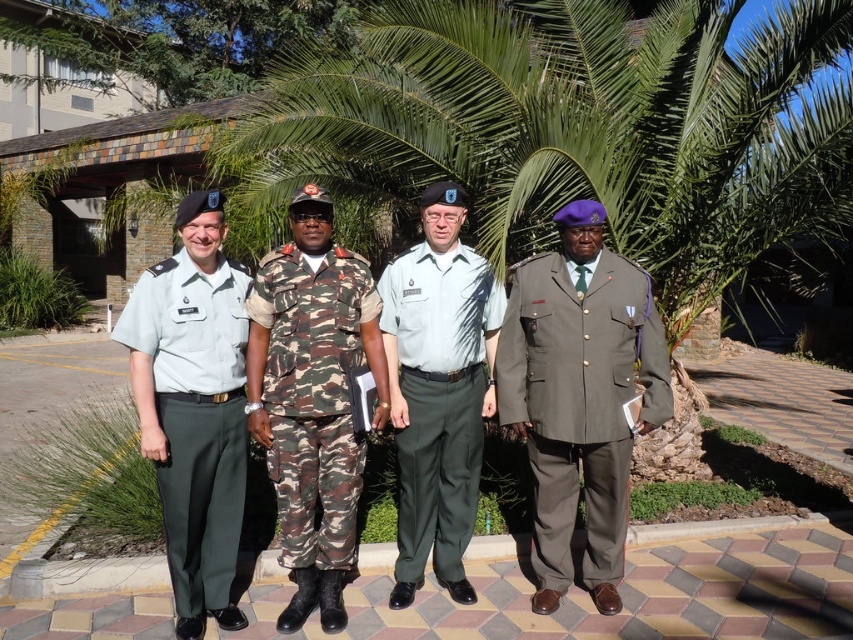
Question: Which object is the farthest from the camo fabric uniform at center?

Choices:
 (A) light gray cotton shirt at center
 (B) camouflage fabric uniform at center
 (C) light green fabric uniform at left

Answer: (A)

Question: Which point is closer to the camera?

Choices:
 (A) camouflage fabric uniform at center
 (B) light green fabric uniform at left
 (C) camo fabric uniform at center
 (D) matte olive-green uniform at center

Answer: (B)

Question: From the image, what is the correct spatial relationship of camouflage fabric uniform at center in relation to light gray cotton shirt at center?

Choices:
 (A) above
 (B) below

Answer: (A)

Question: Does matte olive-green uniform at center have a smaller size compared to light gray cotton shirt at center?

Choices:
 (A) no
 (B) yes

Answer: (A)

Question: Which of these objects is positioned farthest from the camo fabric uniform at center?

Choices:
 (A) matte olive-green uniform at center
 (B) light gray cotton shirt at center

Answer: (A)

Question: Is light green fabric uniform at left positioned before camo fabric uniform at center?

Choices:
 (A) yes
 (B) no

Answer: (A)